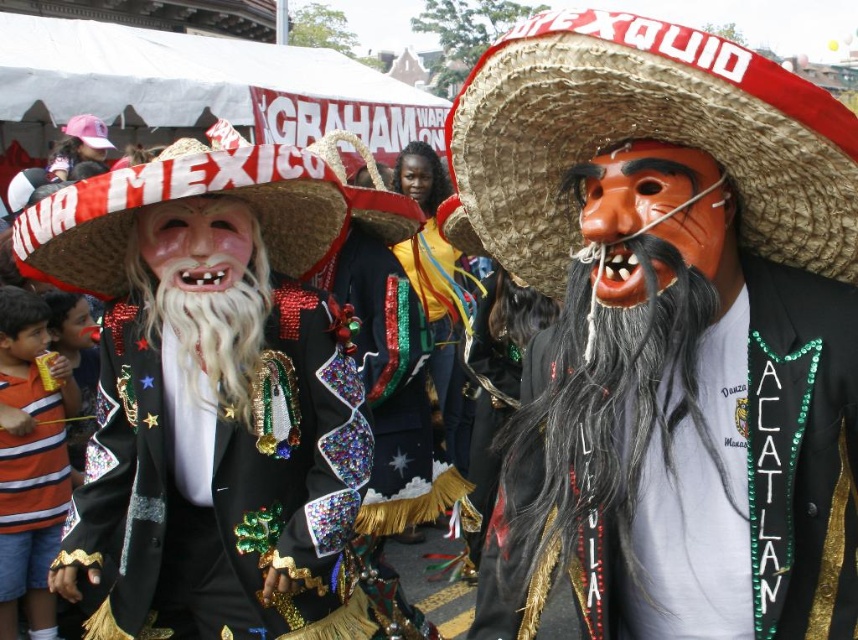
Looking at this image, does matte black mask at center appear under brown straw sombrero at center?

Indeed, matte black mask at center is positioned under brown straw sombrero at center.

Which is below, matte black mask at center or brown straw sombrero at center?

matte black mask at center

Image resolution: width=858 pixels, height=640 pixels. What do you see at coordinates (669, 330) in the screenshot?
I see `matte black mask at center` at bounding box center [669, 330].

In order to click on matte black mask at center in this screenshot , I will do [x=669, y=330].

The height and width of the screenshot is (640, 858). What do you see at coordinates (208, 195) in the screenshot?
I see `straw sombrero at left` at bounding box center [208, 195].

Is straw sombrero at left to the right of whitehair/fiberbeard at center from the viewer's perspective?

Indeed, straw sombrero at left is positioned on the right side of whitehair/fiberbeard at center.

Does point (261, 214) lie in front of point (263, 321)?

No, (261, 214) is behind (263, 321).

The width and height of the screenshot is (858, 640). Find the location of `straw sombrero at left`. straw sombrero at left is located at coordinates (208, 195).

Which of these two, brown straw sombrero at center or shiny sequined jacket at center, stands taller?

With more height is shiny sequined jacket at center.

Where is `brown straw sombrero at center`? brown straw sombrero at center is located at coordinates (644, 138).

Who is more forward, (766, 257) or (258, 618)?

Point (766, 257) is more forward.

Identify the location of brown straw sombrero at center. (644, 138).